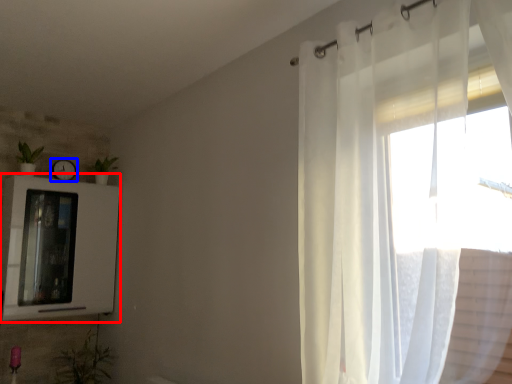
Question: Which point is further to the camera, medicine cabinet (highlighted by a red box) or clock (highlighted by a blue box)?

Choices:
 (A) medicine cabinet
 (B) clock

Answer: (B)